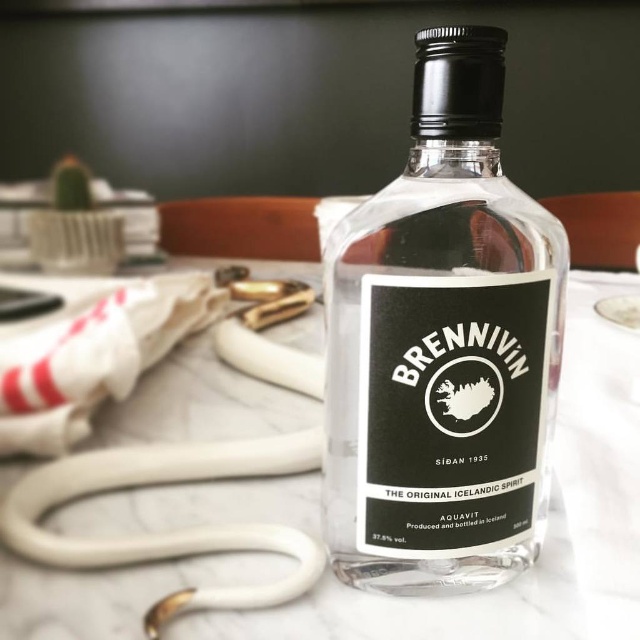
You are organizing a bar display and need to ensure that the transparent glass bottle at center and the white marble table at center fit within a 1.2 square meter area. Based on their sizes, will both items fit comfortably?

The transparent glass bottle at center occupies less space than the white marble table at center. Since the total area required for both items is likely under 1.2 square meters, they should fit comfortably within the designated space.

Where is the transparent glass bottle at center located in the image?

The transparent glass bottle at center is located at point (442, 346) in the image.

You are an assistant trying to locate two points on the Brennivin bottle label. The first point is at coordinates point (x=371, y=563) and the second is at point (x=51, y=604). Which point is closer to the top edge of the bottle label?

Point (x=51, y=604) is closer to the top edge of the bottle label because it has a lower y coordinate value, which in image coordinates typically corresponds to being higher up on the screen or label.